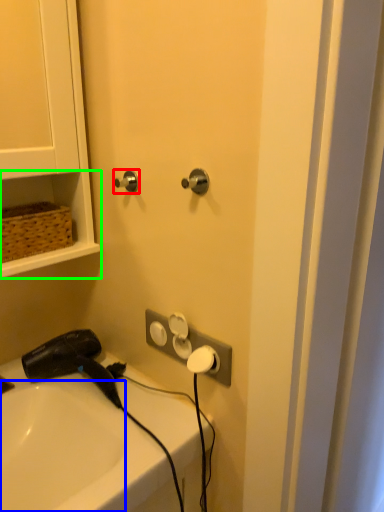
Question: Estimate the real-world distances between objects in this image. Which object is closer to door handle (highlighted by a red box), sink (highlighted by a blue box) or shelf (highlighted by a green box)?

Choices:
 (A) sink
 (B) shelf

Answer: (B)